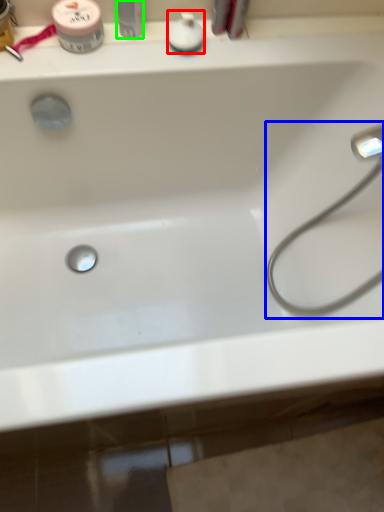
Question: Which is nearer to the toiletry (highlighted by a red box)? faucet (highlighted by a blue box) or toiletry (highlighted by a green box).

Choices:
 (A) faucet
 (B) toiletry

Answer: (B)